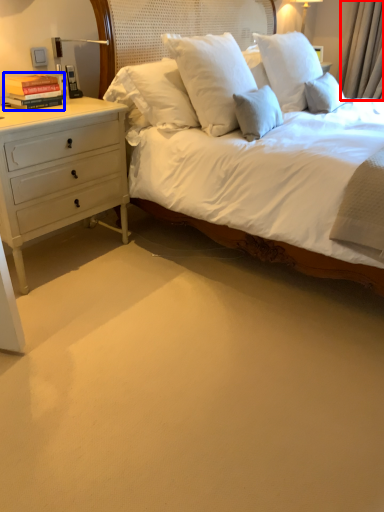
Question: Which object is closer to the camera taking this photo, curtain (highlighted by a red box) or book (highlighted by a blue box)?

Choices:
 (A) curtain
 (B) book

Answer: (B)